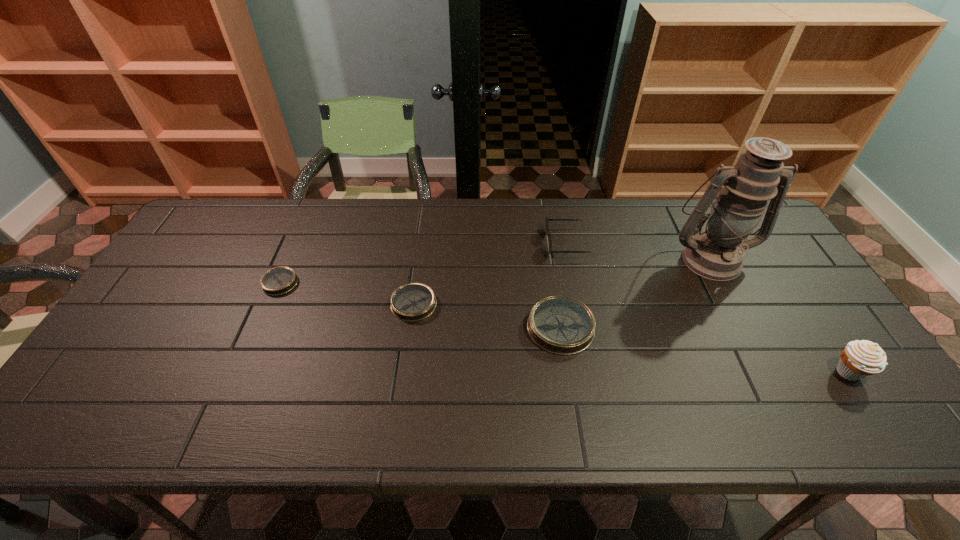
You are a GUI agent. You are given a task and a screenshot of the screen. Output one action in this format:
    pyautogui.click(x=<x>, y=<y>)
    Task: Click on the shortest object
    This screenshot has height=540, width=960.
    Given the screenshot: What is the action you would take?
    pyautogui.click(x=277, y=281)

The image size is (960, 540). I want to click on the leftmost object, so click(x=277, y=281).

You are a GUI agent. You are given a task and a screenshot of the screen. Output one action in this format:
    pyautogui.click(x=<x>, y=<y>)
    Task: Click on the second object from left to right
    This screenshot has height=540, width=960.
    Given the screenshot: What is the action you would take?
    pyautogui.click(x=411, y=302)

Locate an element on the screen. This screenshot has width=960, height=540. the second compass from left to right is located at coordinates (411, 302).

Locate an element on the screen. The height and width of the screenshot is (540, 960). the rightmost compass is located at coordinates (561, 325).

Identify the location of the tallest compass. (561, 325).

I want to click on sunglasses, so click(547, 219).

The image size is (960, 540). In order to click on the tallest object in this screenshot , I will do `click(717, 253)`.

The height and width of the screenshot is (540, 960). Find the location of `the fifth object from left to right`. the fifth object from left to right is located at coordinates (717, 253).

This screenshot has width=960, height=540. Find the location of `muffin`. muffin is located at coordinates (859, 359).